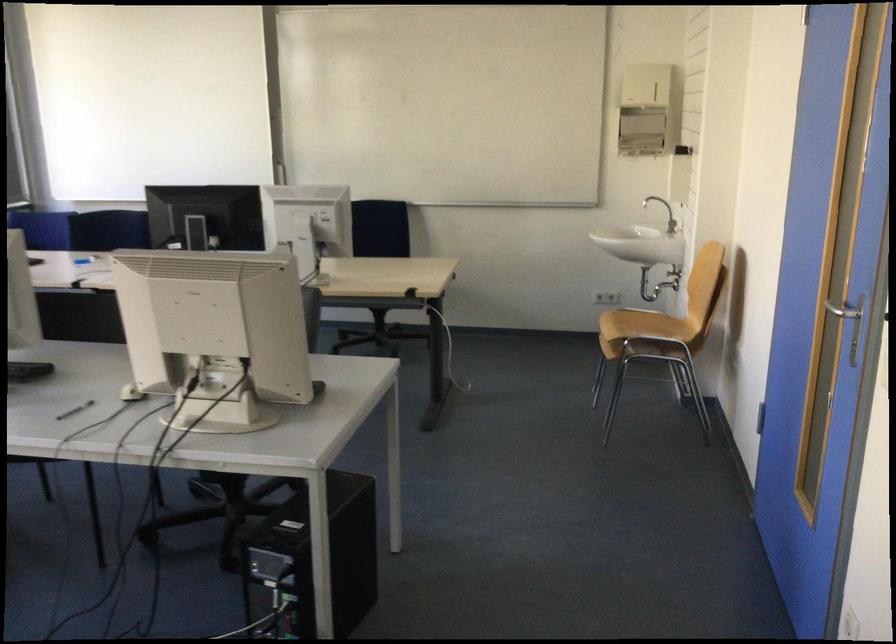
The width and height of the screenshot is (896, 644). I want to click on sink faucet handle, so click(647, 210).